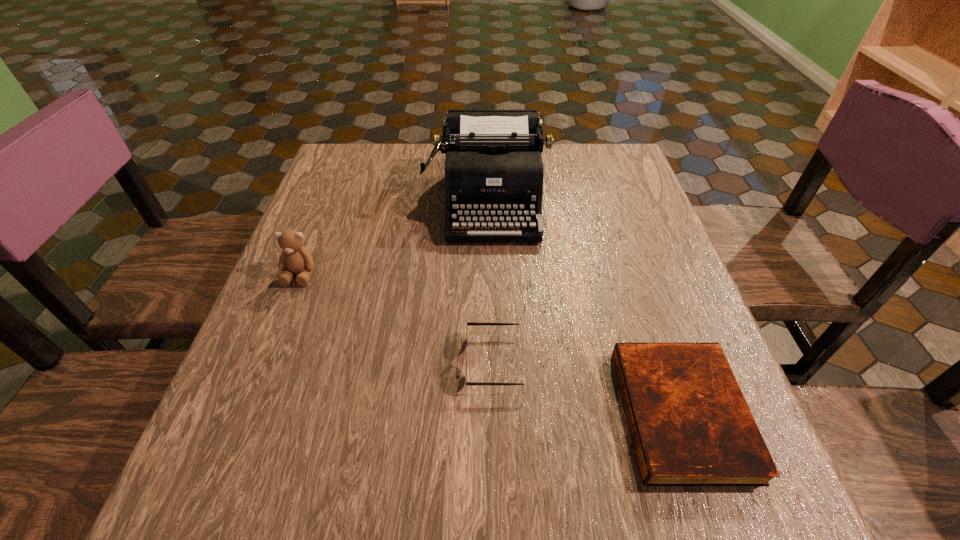
The width and height of the screenshot is (960, 540). In order to click on typewriter in this screenshot , I will do `click(494, 171)`.

What are the coordinates of `the tallest object` in the screenshot? It's located at (494, 171).

The image size is (960, 540). I want to click on the third shortest object, so click(x=295, y=258).

This screenshot has height=540, width=960. Identify the location of teddy bear. (295, 258).

I want to click on sunglasses, so click(468, 323).

At what (x,y) coordinates should I click in order to perform the action: click on the shortest object. Please return your answer as a coordinate pair (x, y). This screenshot has width=960, height=540. Looking at the image, I should click on (690, 425).

Where is `Bible`? Bible is located at coordinates (690, 425).

Locate an element on the screen. This screenshot has height=540, width=960. free space located 0.240m on the typing side of the tallest object is located at coordinates (492, 332).

You are a GUI agent. You are given a task and a screenshot of the screen. Output one action in this format:
    pyautogui.click(x=<x>, y=<y>)
    Task: Click on the vacant area located on the face of the teddy bear
    The image size is (960, 540).
    Given the screenshot: What is the action you would take?
    pyautogui.click(x=259, y=377)

Locate an element on the screen. free spot located on the front-facing side of the sunglasses is located at coordinates (336, 361).